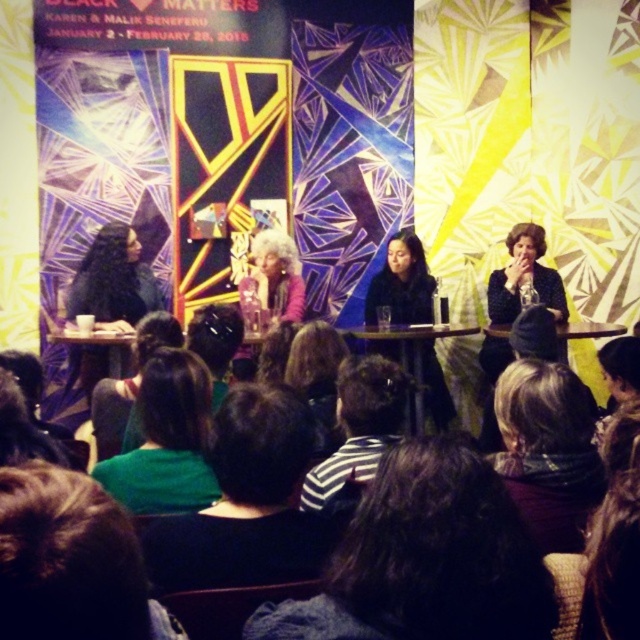
Can you confirm if matte black jacket at left is wider than matte black jacket at center?

No, matte black jacket at left is not wider than matte black jacket at center.

Who is more forward, (128, 294) or (424, 346)?

Positioned in front is point (128, 294).

Does point (97, 321) lie in front of point (444, 413)?

That is True.

Find the location of a particular element. matte black jacket at left is located at coordinates (113, 280).

Can you confirm if matte black jacket at left is smaller than fuzzy pink sweater at center?

Indeed, matte black jacket at left has a smaller size compared to fuzzy pink sweater at center.

Can you confirm if matte black jacket at left is wider than fuzzy pink sweater at center?

Yes.

Between point (109, 252) and point (269, 316), which one is positioned behind?

Point (269, 316)

Where is `matte black jacket at left`? matte black jacket at left is located at coordinates (113, 280).

Is green fabric shirt at lower center positioned in front of striped fabric at center?

Yes, green fabric shirt at lower center is in front of striped fabric at center.

Between green fabric shirt at lower center and striped fabric at center, which one appears on the right side from the viewer's perspective?

From the viewer's perspective, striped fabric at center appears more on the right side.

The width and height of the screenshot is (640, 640). What do you see at coordinates (246, 502) in the screenshot? I see `green fabric shirt at lower center` at bounding box center [246, 502].

This screenshot has width=640, height=640. In order to click on green fabric shirt at lower center in this screenshot , I will do `click(246, 502)`.